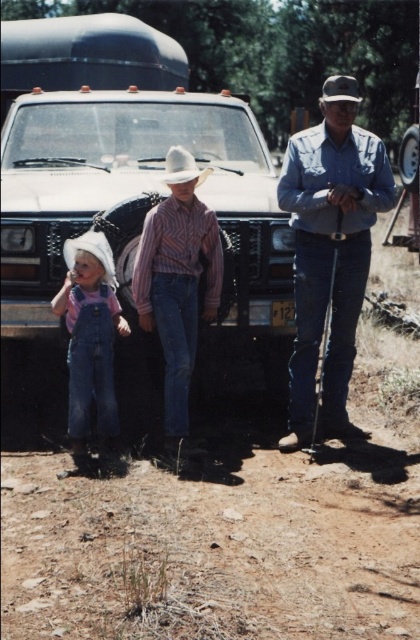
Question: Is brown dirt track at lower center to the left of denim overalls at left from the viewer's perspective?

Choices:
 (A) yes
 (B) no

Answer: (B)

Question: Which point is closer to the camera taking this photo?

Choices:
 (A) (301, 211)
 (B) (60, 228)
 (C) (196, 273)

Answer: (A)

Question: Which object is the closest to the blue denim jeans at right?

Choices:
 (A) white felt cowboy hat at center
 (B) matte white truck at center
 (C) white felt cowboy hat at upper center
 (D) brown dirt track at lower center

Answer: (A)

Question: Which point is closer to the camera?

Choices:
 (A) (336, 204)
 (B) (76, 280)
 (C) (168, 170)

Answer: (B)

Question: Is striped cotton shirt at center to the right of white felt cowboy hat at upper center from the viewer's perspective?

Choices:
 (A) yes
 (B) no

Answer: (B)

Question: Does blue denim jeans at right appear on the left side of striped cotton shirt at center?

Choices:
 (A) no
 (B) yes

Answer: (A)